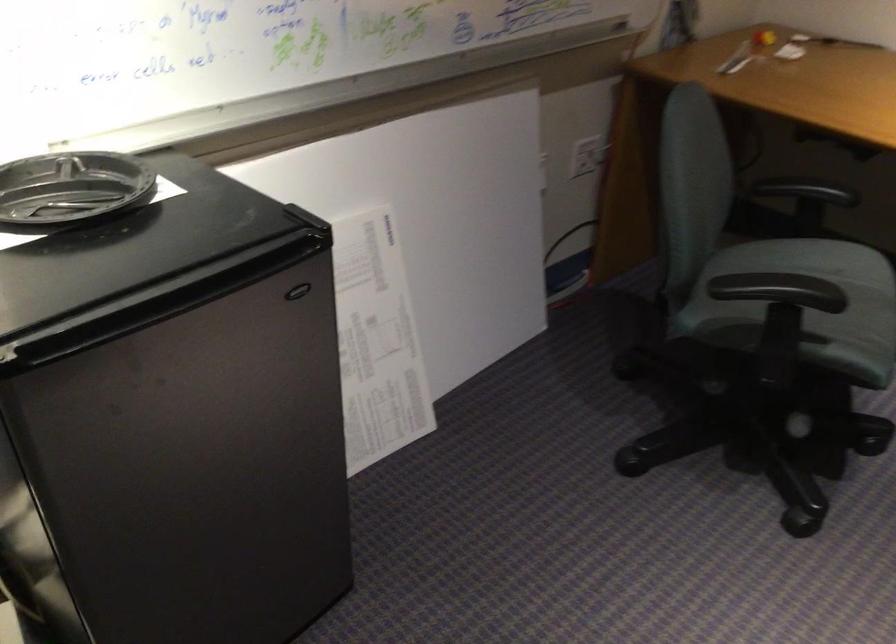
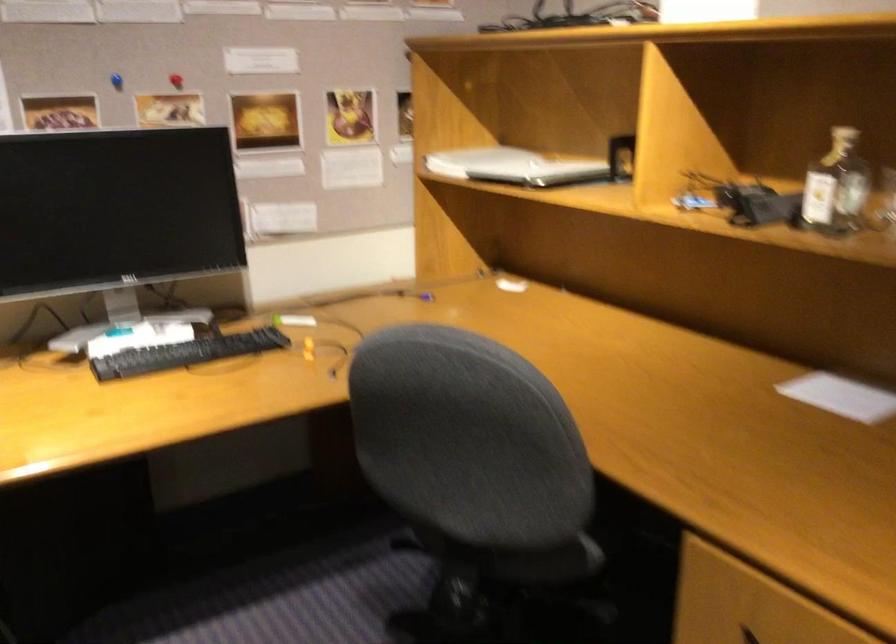
Question: How did the camera likely rotate?

Choices:
 (A) Left
 (B) Right
 (C) Up
 (D) Down

Answer: (B)